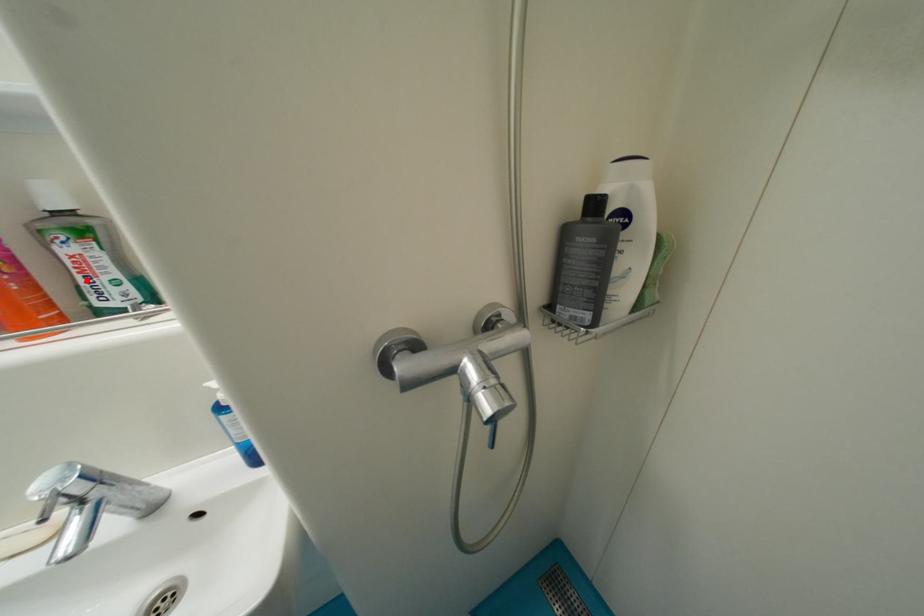
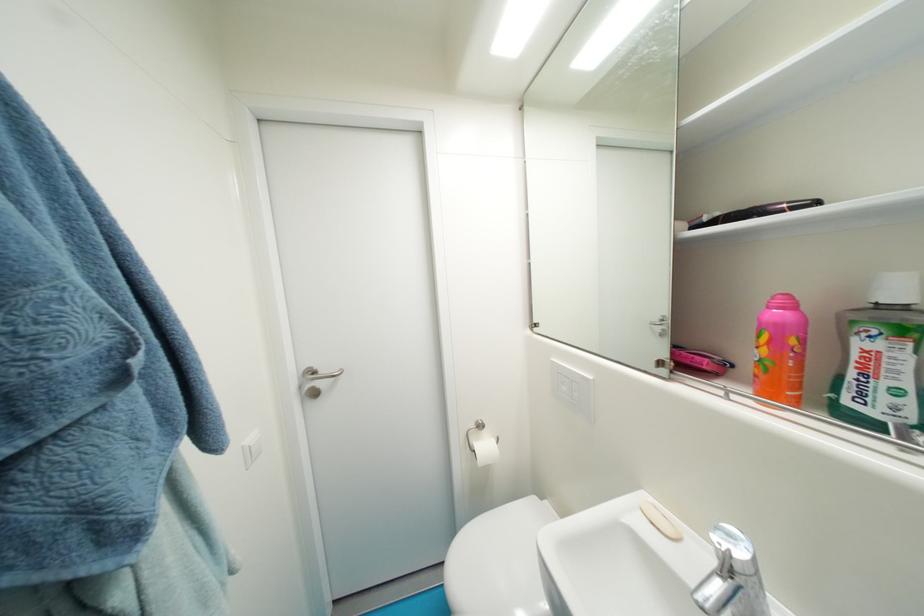
Where in the second image is the point corresponding to the highlighted location from the first image?

(858, 376)